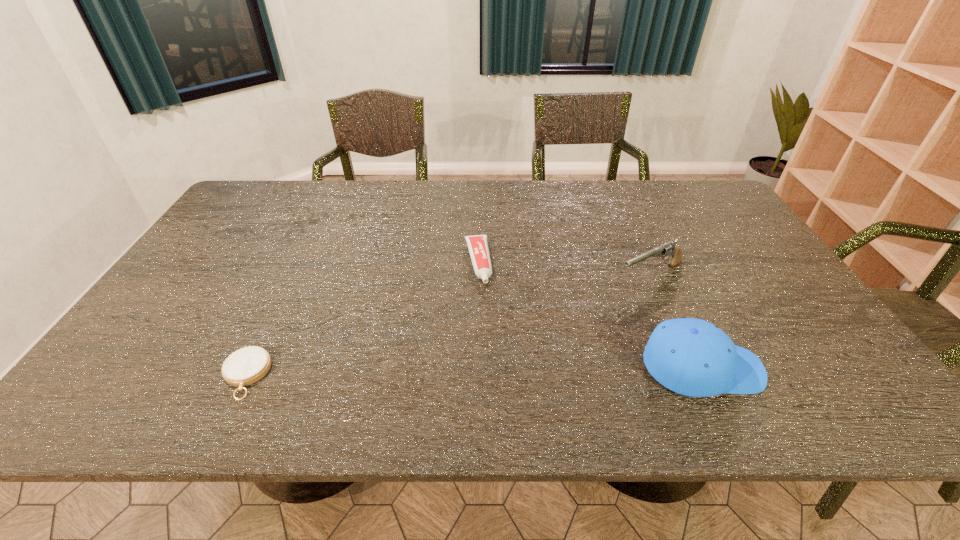
In the image, there is a desktop. Identify the location of vacant space at the far left corner. The height and width of the screenshot is (540, 960). pos(255,209).

This screenshot has width=960, height=540. What are the coordinates of `free space at the near right corner of the desktop` in the screenshot? It's located at (848, 364).

You are a GUI agent. You are given a task and a screenshot of the screen. Output one action in this format:
    pyautogui.click(x=<x>, y=<y>)
    Task: Click on the vacant space that is in between the third object from right to left and the third shortest object
    This screenshot has width=960, height=540.
    Given the screenshot: What is the action you would take?
    pyautogui.click(x=564, y=269)

Identify the location of free space between the shortest object and the cap. (473, 372).

At what (x,y) coordinates should I click in order to perform the action: click on vacant space that's between the leftmost object and the cap. Please return your answer as a coordinate pair (x, y). The image size is (960, 540). Looking at the image, I should click on (473, 372).

The height and width of the screenshot is (540, 960). Identify the location of blank region between the second tallest object and the leftmost object. (448, 325).

Identify the location of vacant region between the gun and the second object from left to right. click(x=564, y=269).

At what (x,y) coordinates should I click in order to perform the action: click on vacant area that lies between the shortest object and the second object from left to right. Please return your answer as a coordinate pair (x, y). This screenshot has height=540, width=960. Looking at the image, I should click on (362, 319).

Where is `free area in between the shortest object and the toothpaste`? The width and height of the screenshot is (960, 540). free area in between the shortest object and the toothpaste is located at coordinates (362, 319).

What are the coordinates of `vacant space that is in between the cap and the leftmost object` in the screenshot? It's located at click(x=473, y=372).